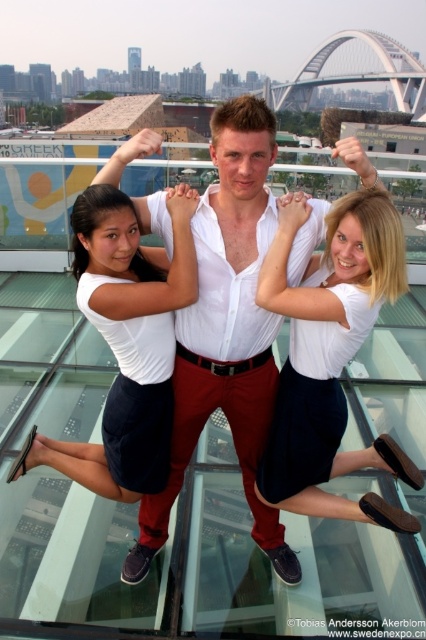
Question: Is white cotton skirt at center closer to the viewer compared to white cotton shirt at center?

Choices:
 (A) no
 (B) yes

Answer: (B)

Question: Which point appears closest to the camera in this image?

Choices:
 (A) (345, 330)
 (B) (184, 188)

Answer: (A)

Question: Which of the following is the farthest from the observer?

Choices:
 (A) (376, 264)
 (B) (157, 381)

Answer: (B)

Question: Is white cotton skirt at center wider than white cotton shirt at center?

Choices:
 (A) yes
 (B) no

Answer: (B)

Question: Which point is closer to the camera?

Choices:
 (A) white cotton shirt at center
 (B) white cotton skirt at center

Answer: (B)

Question: Where is white cotton skirt at center located in relation to white cotton shirt at center in the image?

Choices:
 (A) right
 (B) left

Answer: (A)